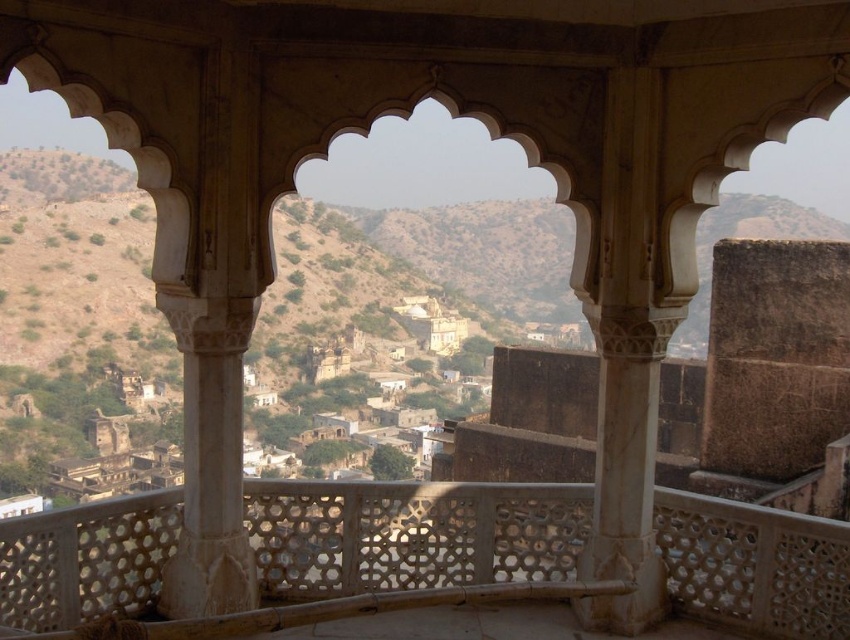
Question: Is the position of white carved stone balcony at center less distant than that of white marble pillar at center?

Choices:
 (A) no
 (B) yes

Answer: (B)

Question: Which point is closer to the camera?

Choices:
 (A) (639, 305)
 (B) (292, 586)

Answer: (A)

Question: Is white carved stone balcony at center below white marble pillar at center?

Choices:
 (A) yes
 (B) no

Answer: (A)

Question: Does white carved stone balcony at center have a larger size compared to white marble pillar at center?

Choices:
 (A) no
 (B) yes

Answer: (A)

Question: Which point is closer to the camera?

Choices:
 (A) white marble pillar at center
 (B) white carved stone balcony at center

Answer: (B)